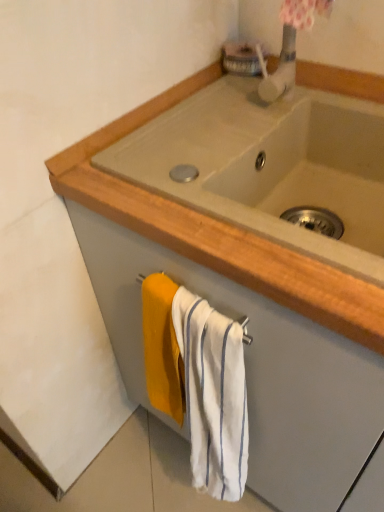
What is the approximate height of white striped towel at lower center?

white striped towel at lower center is 20.74 inches tall.

At what (x,y) coordinates should I click in order to perform the action: click on white striped towel at lower center. Please return your answer as a coordinate pair (x, y). The height and width of the screenshot is (512, 384). Looking at the image, I should click on (213, 395).

What do you see at coordinates (213, 395) in the screenshot? I see `white striped towel at lower center` at bounding box center [213, 395].

What do you see at coordinates (269, 165) in the screenshot?
I see `beige ceramic sink at center` at bounding box center [269, 165].

The height and width of the screenshot is (512, 384). Identify the location of beige ceramic sink at center. click(x=269, y=165).

Where is `white striped towel at lower center`? white striped towel at lower center is located at coordinates (213, 395).

Considering the relative positions of white striped towel at lower center and beige ceramic sink at center in the image provided, is white striped towel at lower center to the right of beige ceramic sink at center from the viewer's perspective?

In fact, white striped towel at lower center is to the left of beige ceramic sink at center.

Considering their positions, is white striped towel at lower center located in front of or behind beige ceramic sink at center?

white striped towel at lower center is positioned farther from the viewer than beige ceramic sink at center.

Considering the positions of point (195, 447) and point (208, 160), is point (195, 447) closer or farther from the camera than point (208, 160)?

Point (195, 447) appears to be farther away from the viewer than point (208, 160).

From the image's perspective, is white striped towel at lower center below beige ceramic sink at center?

Yes.

From a real-world perspective, is white striped towel at lower center on top of beige ceramic sink at center?

No, from a real-world perspective, white striped towel at lower center is not over beige ceramic sink at center

Considering the relative sizes of white striped towel at lower center and beige ceramic sink at center in the image provided, is white striped towel at lower center thinner than beige ceramic sink at center?

Indeed, white striped towel at lower center has a lesser width compared to beige ceramic sink at center.

Is white striped towel at lower center shorter than beige ceramic sink at center?

In fact, white striped towel at lower center may be taller than beige ceramic sink at center.

Considering the sizes of objects white striped towel at lower center and beige ceramic sink at center in the image provided, who is smaller, white striped towel at lower center or beige ceramic sink at center?

Smaller between the two is white striped towel at lower center.

Which is correct: white striped towel at lower center is inside beige ceramic sink at center, or outside of it?

white striped towel at lower center exists outside the volume of beige ceramic sink at center.

Are white striped towel at lower center and beige ceramic sink at center far apart?

No, there isn't a large distance between white striped towel at lower center and beige ceramic sink at center.

Is white striped towel at lower center turned away from beige ceramic sink at center?

Yes.

How distant is white striped towel at lower center from beige ceramic sink at center?

white striped towel at lower center and beige ceramic sink at center are 13.22 inches apart.

Find the location of a particular element. This screenshot has width=384, height=512. bath towel located on the left of beige ceramic sink at center is located at coordinates (213, 395).

In the image, is beige ceramic sink at center on the left side or the right side of white striped towel at lower center?

Based on their positions, beige ceramic sink at center is located to the right of white striped towel at lower center.

From the picture: Is the depth of beige ceramic sink at center greater than that of white striped towel at lower center?

No, beige ceramic sink at center is closer to the viewer.

Is point (309, 135) farther from viewer compared to point (191, 340)?

Yes, point (309, 135) is behind point (191, 340).

From the image's perspective, would you say beige ceramic sink at center is positioned over white striped towel at lower center?

Indeed, from the image's perspective, beige ceramic sink at center is shown above white striped towel at lower center.

From a real-world perspective, is beige ceramic sink at center physically below white striped towel at lower center?

No, from a real-world perspective, beige ceramic sink at center is not below white striped towel at lower center.

Can you confirm if beige ceramic sink at center is thinner than white striped towel at lower center?

No, beige ceramic sink at center is not thinner than white striped towel at lower center.

Can you confirm if beige ceramic sink at center is shorter than white striped towel at lower center?

Indeed, beige ceramic sink at center has a lesser height compared to white striped towel at lower center.

Which of these two, beige ceramic sink at center or white striped towel at lower center, is bigger?

beige ceramic sink at center is bigger.

Is beige ceramic sink at center surrounding white striped towel at lower center?

No, white striped towel at lower center is located outside of beige ceramic sink at center.

Would you say beige ceramic sink at center is a long distance from white striped towel at lower center?

Actually, beige ceramic sink at center and white striped towel at lower center are a little close together.

Is beige ceramic sink at center turned away from white striped towel at lower center?

No, beige ceramic sink at center is not facing away from white striped towel at lower center.

How different are the orientations of beige ceramic sink at center and white striped towel at lower center in degrees?

beige ceramic sink at center and white striped towel at lower center are facing 0.572 degrees away from each other.

In the scene shown: How distant is beige ceramic sink at center from white striped towel at lower center?

The distance of beige ceramic sink at center from white striped towel at lower center is 13.22 inches.

Identify the location of sink lying above the white striped towel at lower center (from the image's perspective). The height and width of the screenshot is (512, 384). (269, 165).

You are a GUI agent. You are given a task and a screenshot of the screen. Output one action in this format:
    pyautogui.click(x=<x>, y=<y>)
    Task: Click on the sink in front of the white striped towel at lower center
    
    Given the screenshot: What is the action you would take?
    pyautogui.click(x=269, y=165)

This screenshot has height=512, width=384. In the image, there is a beige ceramic sink at center. In order to click on bath towel below it (from the image's perspective) in this screenshot , I will do `click(213, 395)`.